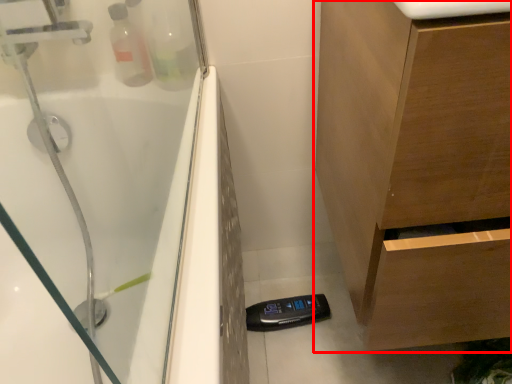
Question: From the image's perspective, where is bathroom cabinet (annotated by the red box) located relative to counter top?

Choices:
 (A) above
 (B) below

Answer: (B)